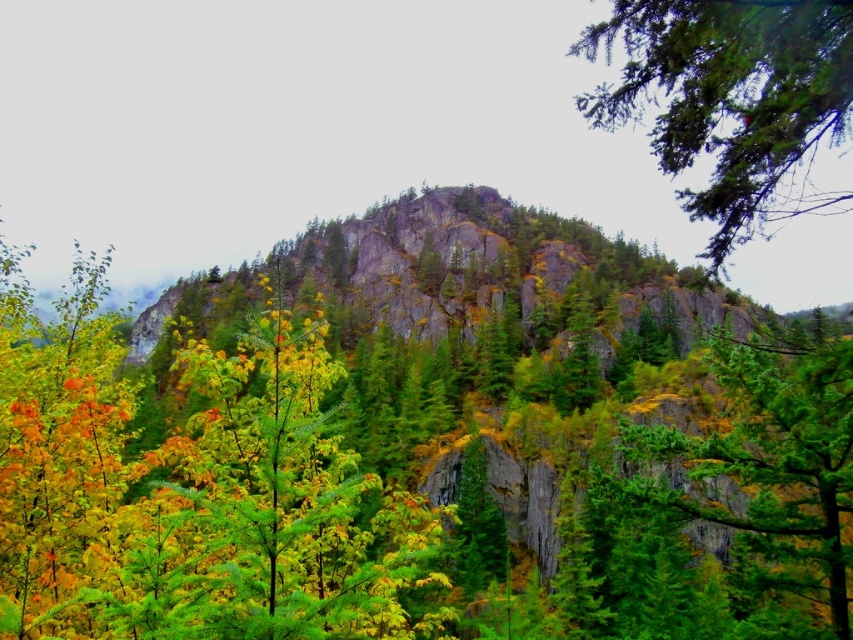
Who is positioned more to the left, green textured branch at upper right or green textured rock at right?

Positioned to the left is green textured rock at right.

Who is shorter, green textured branch at upper right or green textured rock at right?

green textured rock at right is shorter.

This screenshot has width=853, height=640. What do you see at coordinates (730, 99) in the screenshot?
I see `green textured branch at upper right` at bounding box center [730, 99].

Identify the location of green textured branch at upper right. (730, 99).